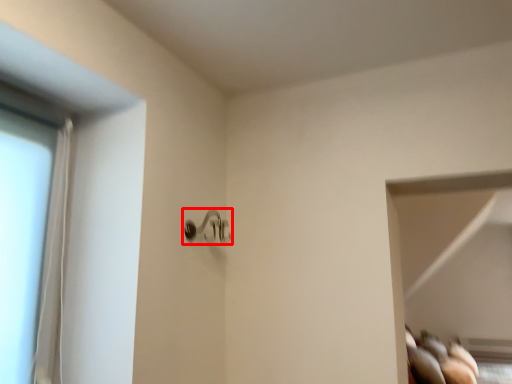
Question: From the image, what is the correct spatial relationship of door handle (annotated by the red box) in relation to glass door?

Choices:
 (A) left
 (B) right

Answer: (B)